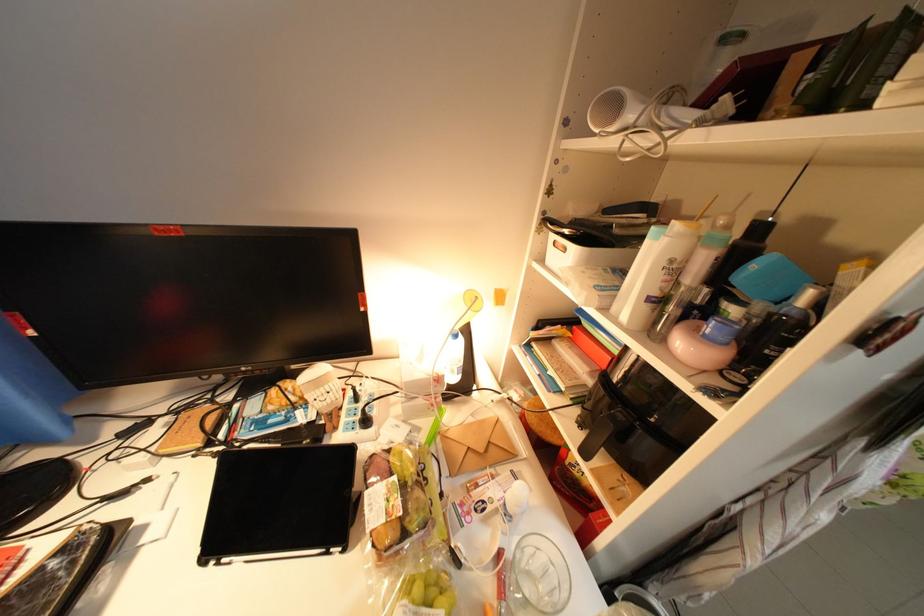
What do you see at coordinates (728, 265) in the screenshot?
I see `the hairbrush handle` at bounding box center [728, 265].